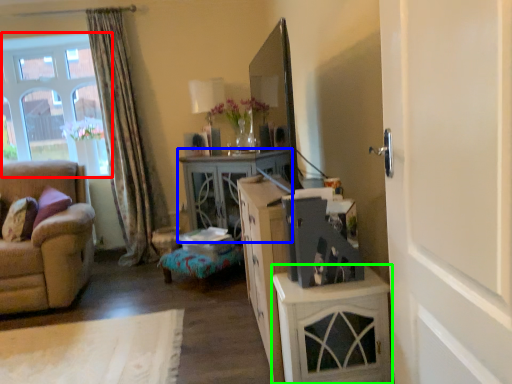
Question: Which object is the farthest from window (highlighted by a red box)? Choose among these: desk (highlighted by a blue box) or cabinetry (highlighted by a green box).

Choices:
 (A) desk
 (B) cabinetry

Answer: (B)